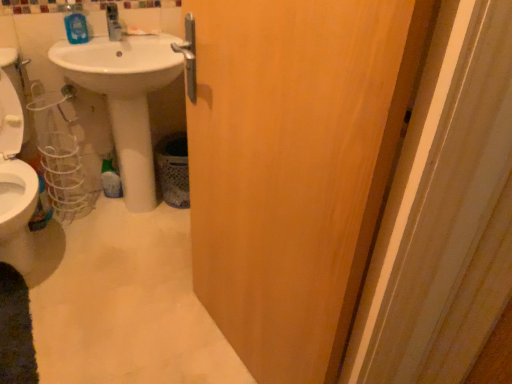
Locate an element on the screen. unoccupied area in front of white glossy sink at center is located at coordinates (129, 270).